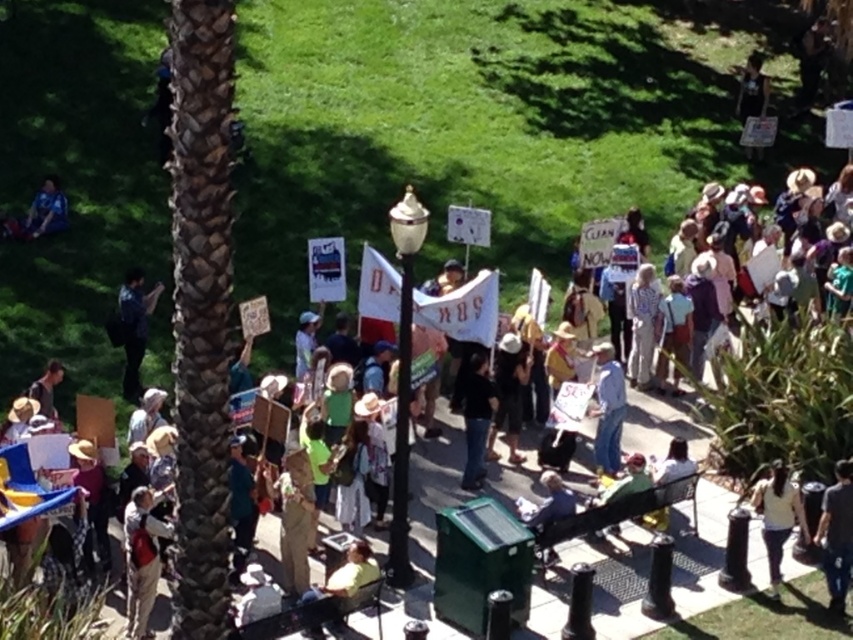
Question: From the image, what is the correct spatial relationship of light yellow shirt at lower right in relation to dark blue shirt at left?

Choices:
 (A) below
 (B) above

Answer: (A)

Question: Which object is the closest to the blue jeans at center?

Choices:
 (A) dark blue jeans at lower right
 (B) light yellow shirt at lower right
 (C) blue fabric shirt at upper left

Answer: (B)

Question: Which object appears farthest from the camera in this image?

Choices:
 (A) dark blue jeans at lower right
 (B) brown textured palm tree at left

Answer: (A)

Question: Considering the real-world distances, which object is closest to the dark blue shirt at left?

Choices:
 (A) light yellow shirt at lower right
 (B) blue jeans at center

Answer: (B)

Question: Where is light yellow shirt at lower right located in relation to blue jeans at center in the image?

Choices:
 (A) below
 (B) above

Answer: (A)

Question: Is brown textured palm tree at left wider than blue jeans at center?

Choices:
 (A) no
 (B) yes

Answer: (A)